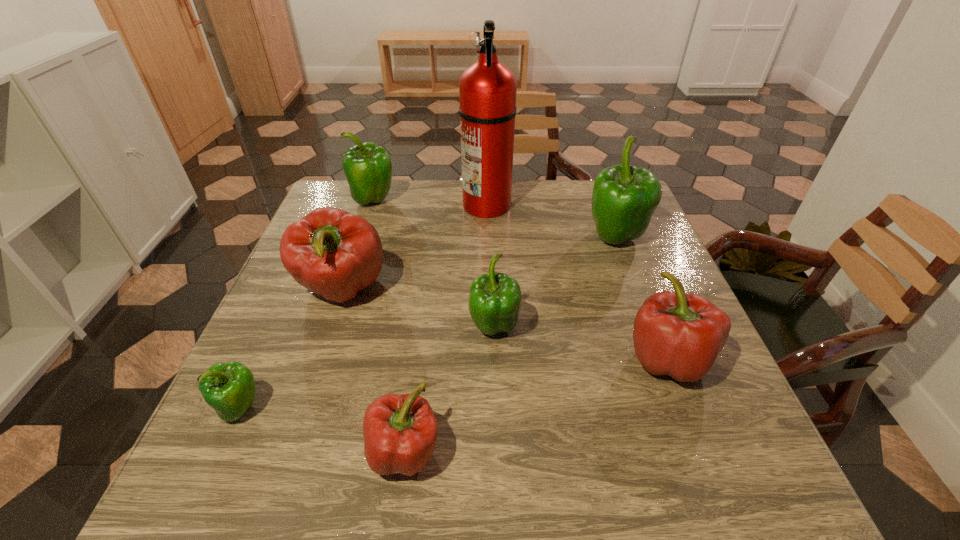
You are a GUI agent. You are given a task and a screenshot of the screen. Output one action in this format:
    pyautogui.click(x=<x>, y=<y>)
    Task: Click on the rightmost pink bell pepper
    
    Given the screenshot: What is the action you would take?
    pyautogui.click(x=676, y=334)

Locate an element on the screen. The image size is (960, 540). the second nearest pink bell pepper is located at coordinates (676, 334).

Find the location of a particular element. The height and width of the screenshot is (540, 960). the smallest green bell pepper is located at coordinates (229, 388).

In order to click on the nearest green bell pepper in this screenshot , I will do `click(229, 388)`.

Locate an element on the screen. The image size is (960, 540). the fourth object from left to right is located at coordinates (400, 431).

Identify the location of the fourth bell pepper from left to right. The height and width of the screenshot is (540, 960). (400, 431).

Find the location of a particular element. This screenshot has height=540, width=960. vacant space located 0.280m at the nozzle of the red fire extinguisher is located at coordinates point(368,204).

The image size is (960, 540). Identify the location of free point located 0.160m at the nozzle of the red fire extinguisher. (408, 204).

Image resolution: width=960 pixels, height=540 pixels. Identify the location of vacant space positioned at the nozzle of the red fire extinguisher. (385, 204).

You are a GUI agent. You are given a task and a screenshot of the screen. Output one action in this format:
    pyautogui.click(x=<x>, y=<y>)
    Task: Click on the free space located 0.260m on the left of the second tallest object
    
    Given the screenshot: What is the action you would take?
    pyautogui.click(x=489, y=239)